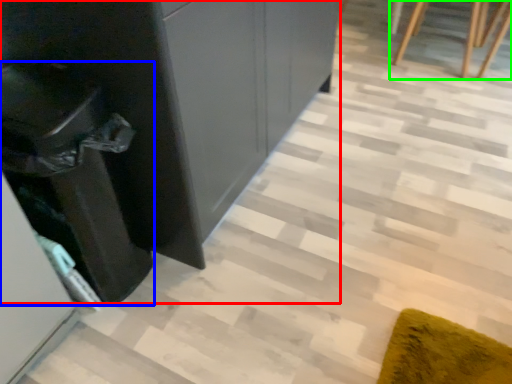
Question: Considering the real-world distances, which object is closest to dresser (highlighted by a red box)? cabinetry (highlighted by a blue box) or furniture (highlighted by a green box).

Choices:
 (A) cabinetry
 (B) furniture

Answer: (A)